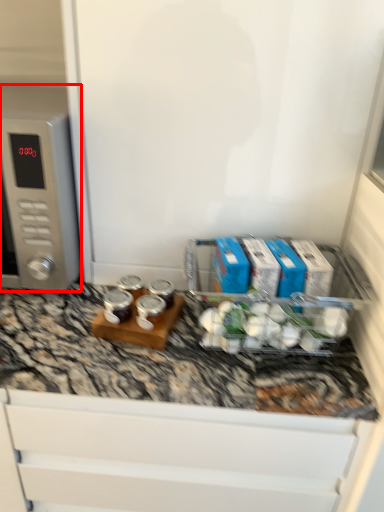
Question: Observing the image, what is the correct spatial positioning of home appliance (annotated by the red box) in reference to appliance?

Choices:
 (A) right
 (B) left

Answer: (B)